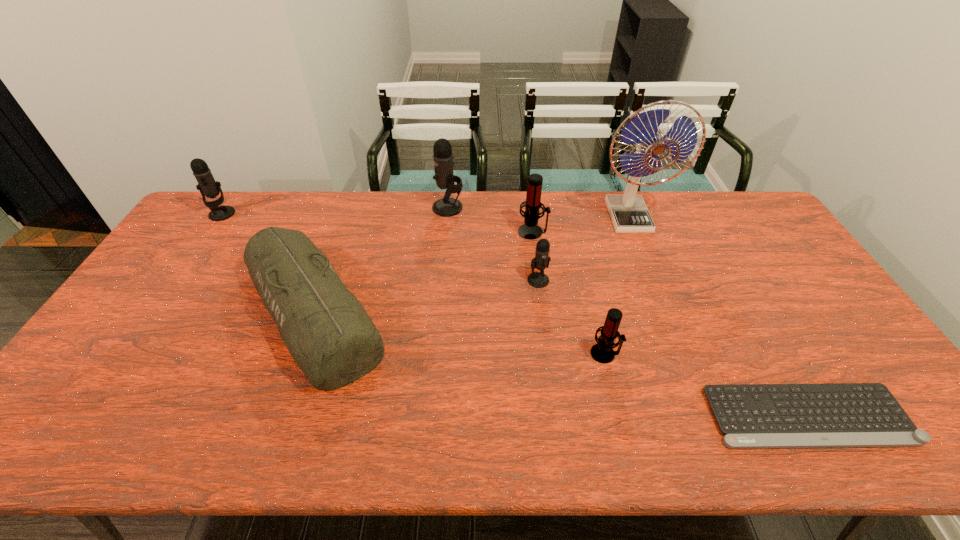
This screenshot has width=960, height=540. I want to click on fan, so click(x=629, y=214).

Find the location of a particular element. This screenshot has height=540, width=960. the tallest object is located at coordinates tap(629, 214).

Locate an element on the screen. The height and width of the screenshot is (540, 960). the biggest black microphone is located at coordinates (443, 158).

Find the location of a particular element. the fourth microphone from right to left is located at coordinates (443, 158).

The width and height of the screenshot is (960, 540). In order to click on the second biggest black microphone in this screenshot , I will do pyautogui.click(x=208, y=187).

Locate an element on the screen. the leftmost black microphone is located at coordinates (208, 187).

The image size is (960, 540). Find the location of `the bigger red microphone`. the bigger red microphone is located at coordinates (530, 230).

The image size is (960, 540). What are the coordinates of `the farther red microphone` in the screenshot? It's located at (530, 230).

Where is `the seventh object from right to left`? The image size is (960, 540). the seventh object from right to left is located at coordinates (330, 336).

The image size is (960, 540). Identify the location of olive duffel bag. (330, 336).